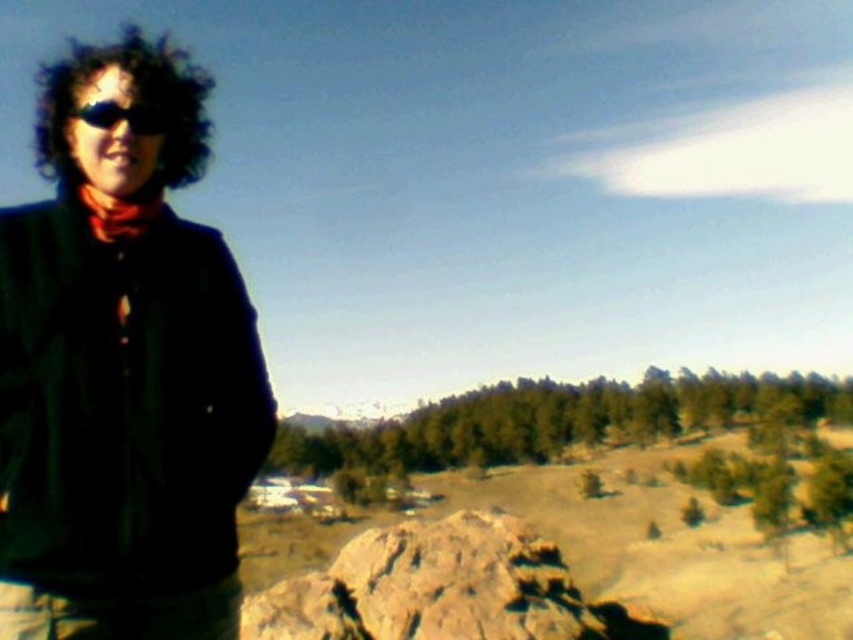
Question: Which point is farther from the camera taking this photo?

Choices:
 (A) (109, 124)
 (B) (62, 484)

Answer: (A)

Question: Can you confirm if dark green fabric jacket at left is positioned to the right of black matte sunglasses at left?

Choices:
 (A) no
 (B) yes

Answer: (B)

Question: Considering the relative positions of dark green fabric jacket at left and black matte sunglasses at left in the image provided, where is dark green fabric jacket at left located with respect to black matte sunglasses at left?

Choices:
 (A) below
 (B) above

Answer: (A)

Question: Does dark green fabric jacket at left have a lesser width compared to brown rough rock at center?

Choices:
 (A) yes
 (B) no

Answer: (A)

Question: Which object is farther from the camera taking this photo?

Choices:
 (A) brown rough rock at center
 (B) dark green fabric jacket at left
 (C) black matte sunglasses at left

Answer: (A)

Question: Which object is closer to the camera taking this photo?

Choices:
 (A) brown rough rock at center
 (B) dark green fabric jacket at left

Answer: (B)